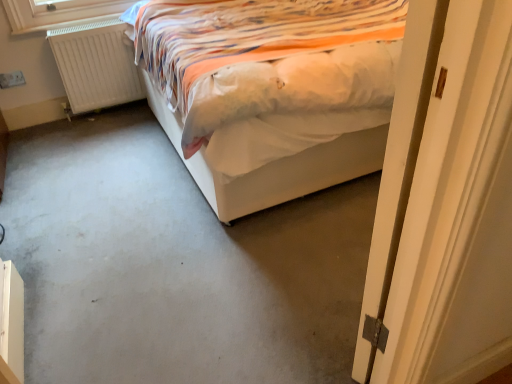
Question: Can you confirm if gray carpet at center is shorter than white fabric bed at center?

Choices:
 (A) yes
 (B) no

Answer: (A)

Question: Is gray carpet at center looking in the opposite direction of white fabric bed at center?

Choices:
 (A) yes
 (B) no

Answer: (B)

Question: Is gray carpet at center smaller than white fabric bed at center?

Choices:
 (A) yes
 (B) no

Answer: (A)

Question: From the image's perspective, is gray carpet at center located beneath white fabric bed at center?

Choices:
 (A) no
 (B) yes

Answer: (B)

Question: Are gray carpet at center and white fabric bed at center far apart?

Choices:
 (A) no
 (B) yes

Answer: (A)

Question: Would you say gray carpet at center is outside white fabric bed at center?

Choices:
 (A) no
 (B) yes

Answer: (B)

Question: Could you tell me if white wooden door at right is facing gray carpet at center?

Choices:
 (A) no
 (B) yes

Answer: (B)

Question: Is white wooden door at right further to the viewer compared to gray carpet at center?

Choices:
 (A) yes
 (B) no

Answer: (B)

Question: Is there a large distance between white wooden door at right and gray carpet at center?

Choices:
 (A) no
 (B) yes

Answer: (A)

Question: Is white wooden door at right smaller than gray carpet at center?

Choices:
 (A) no
 (B) yes

Answer: (A)

Question: Is white wooden door at right positioned with its back to gray carpet at center?

Choices:
 (A) yes
 (B) no

Answer: (B)

Question: Is the surface of white wooden door at right in direct contact with gray carpet at center?

Choices:
 (A) yes
 (B) no

Answer: (B)

Question: Is white matte radiator at left at the back of white wooden door at right?

Choices:
 (A) no
 (B) yes

Answer: (A)